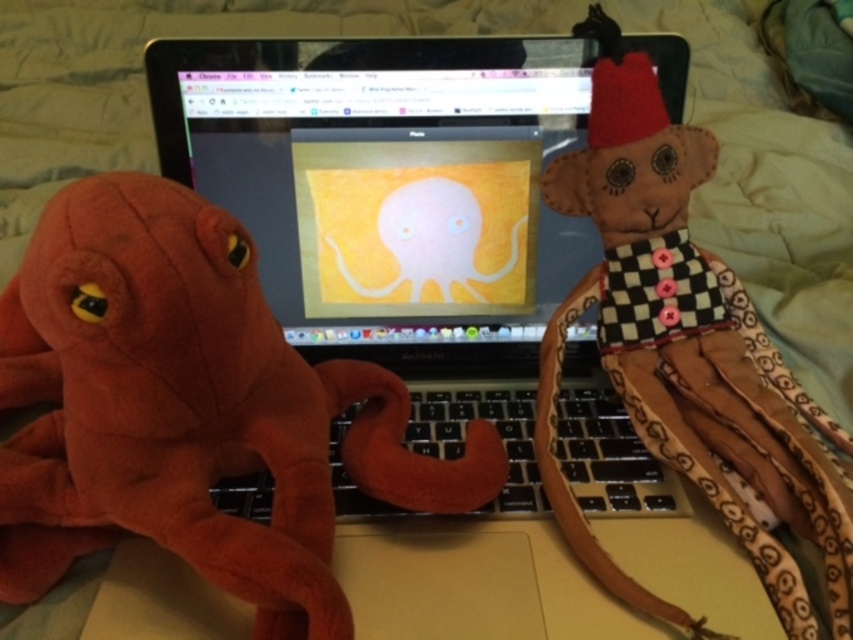
Is soft plush octopus at left bigger than brown fabric monkey at right?

Yes, soft plush octopus at left is bigger than brown fabric monkey at right.

Between point (314, 493) and point (547, 426), which one is positioned in front?

Positioned in front is point (314, 493).

The width and height of the screenshot is (853, 640). Find the location of `soft plush octopus at left`. soft plush octopus at left is located at coordinates click(x=189, y=410).

Which is more to the left, matte plastic laptop at center or brown fabric monkey at right?

From the viewer's perspective, matte plastic laptop at center appears more on the left side.

Locate an element on the screen. The image size is (853, 640). matte plastic laptop at center is located at coordinates (386, 177).

Identify the location of matte plastic laptop at center. (386, 177).

Is point (76, 198) positioned after point (492, 193)?

No, it is not.

Does soft plush octopus at left have a greater height compared to matte plastic laptop at center?

Correct, soft plush octopus at left is much taller as matte plastic laptop at center.

The image size is (853, 640). Identify the location of soft plush octopus at left. (189, 410).